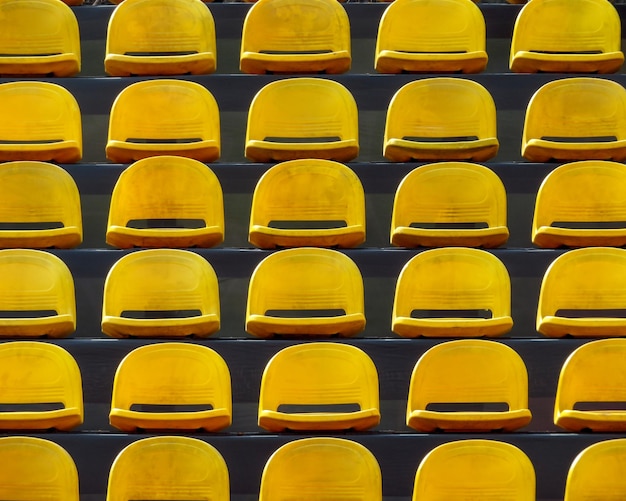
This screenshot has height=501, width=626. I want to click on top row of seats, so click(x=47, y=40), click(x=130, y=39), click(x=307, y=38), click(x=402, y=32), click(x=570, y=28).